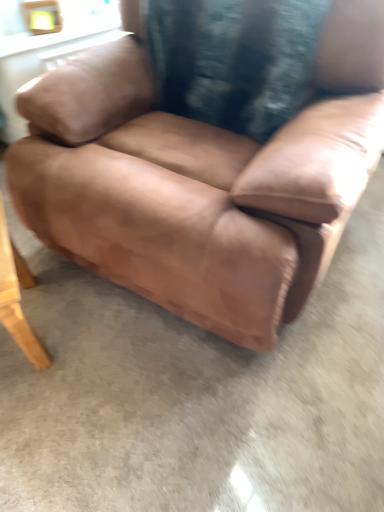
At what (x,y) coordinates should I click in order to perform the action: click on free space that is in between wooden table at lower left and brown leather chair at center. Please return your answer as a coordinate pair (x, y). The image size is (384, 512). Looking at the image, I should click on (119, 344).